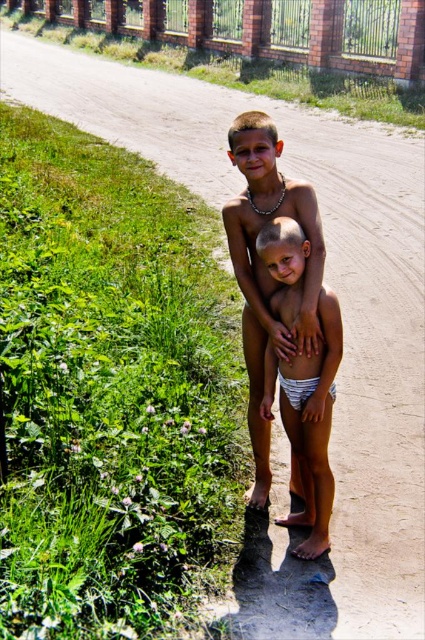
Question: Which object appears farthest from the camera in this image?

Choices:
 (A) smooth skin boy at center
 (B) white striped underwear at center

Answer: (A)

Question: Estimate the real-world distances between objects in this image. Which object is farther from the brick wall at upper center?

Choices:
 (A) white striped underwear at center
 (B) smooth skin boy at center
 (C) white striped fabric diaper at center

Answer: (B)

Question: Does smooth skin boy at center have a smaller size compared to white striped fabric diaper at center?

Choices:
 (A) no
 (B) yes

Answer: (A)

Question: Can you confirm if brick wall at upper center is bigger than white striped fabric diaper at center?

Choices:
 (A) yes
 (B) no

Answer: (A)

Question: Is smooth skin boy at center to the left of white striped underwear at center from the viewer's perspective?

Choices:
 (A) yes
 (B) no

Answer: (A)

Question: Which object is the closest to the white striped underwear at center?

Choices:
 (A) brick wall at upper center
 (B) smooth skin boy at center
 (C) white striped fabric diaper at center

Answer: (C)